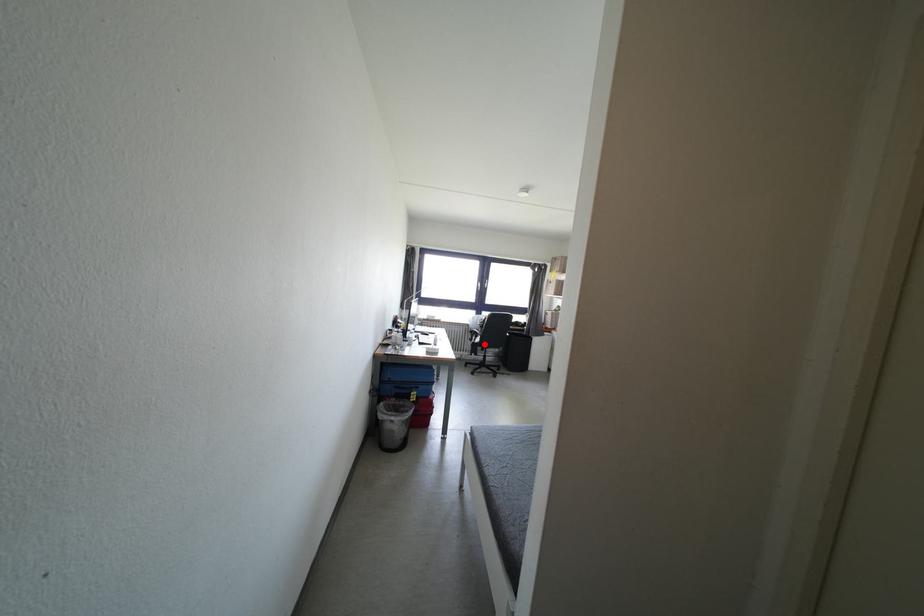
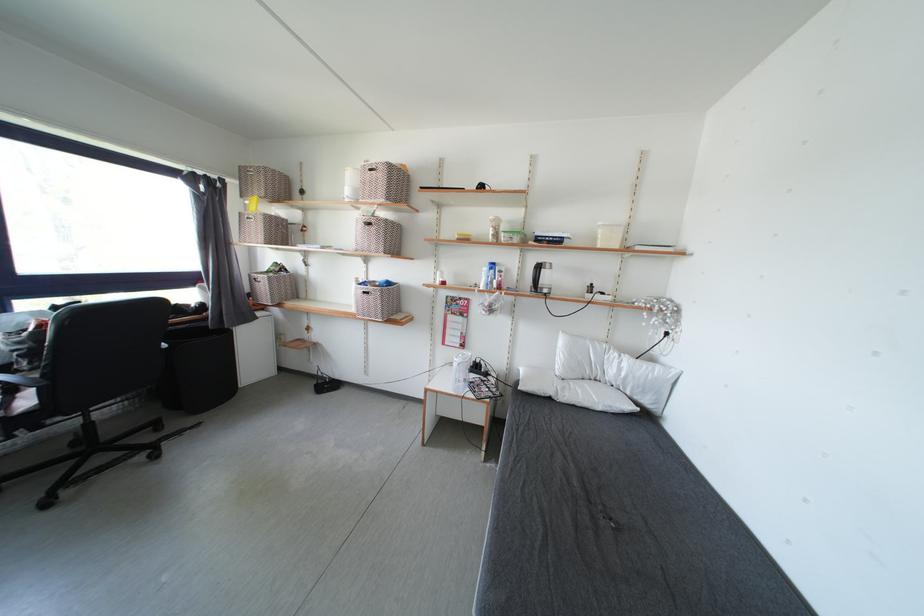
In the second image, find the point that corresponds to the highlighted location in the first image.

(33, 407)